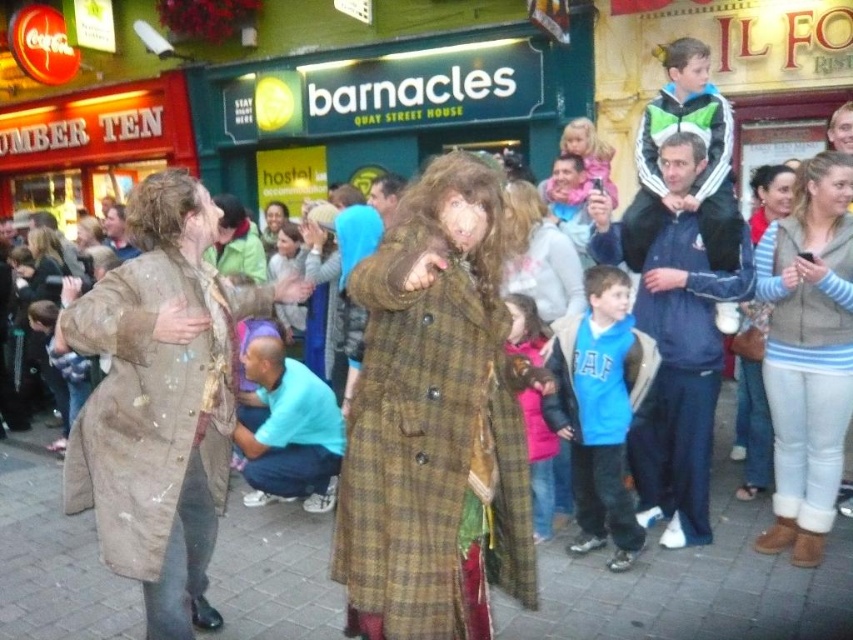
Does point (839, 460) lie behind point (105, 214)?

No, it is in front of (105, 214).

Which is behind, point (770, 342) or point (109, 209)?

Point (109, 209)

The image size is (853, 640). In order to click on light gray fleece vest at right in this screenshot , I will do click(808, 353).

Who is positioned more to the right, brown plaid coat at center or blue cotton shirt at lower left?

From the viewer's perspective, brown plaid coat at center appears more on the right side.

Does brown plaid coat at center have a lesser height compared to blue cotton shirt at lower left?

Incorrect, brown plaid coat at center's height does not fall short of blue cotton shirt at lower left's.

Which is behind, point (514, 588) or point (289, 364)?

The point (289, 364) is more distant.

Image resolution: width=853 pixels, height=640 pixels. Find the location of `brown plaid coat at center`. brown plaid coat at center is located at coordinates (431, 451).

Who is positioned more to the left, brown textured coat at left or brown wool coat at center?

Positioned to the left is brown wool coat at center.

Based on the photo, between brown textured coat at left and brown wool coat at center, which one has more height?

brown textured coat at left

Between point (68, 508) and point (126, 257), which one is positioned behind?

Positioned behind is point (126, 257).

Where is `brown textured coat at left`? brown textured coat at left is located at coordinates (161, 401).